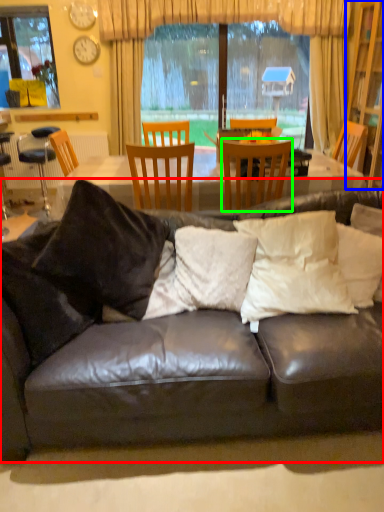
Question: Which object is the closest to the studio couch (highlighted by a red box)? Choose among these: cabinetry (highlighted by a blue box) or chair (highlighted by a green box).

Choices:
 (A) cabinetry
 (B) chair

Answer: (B)